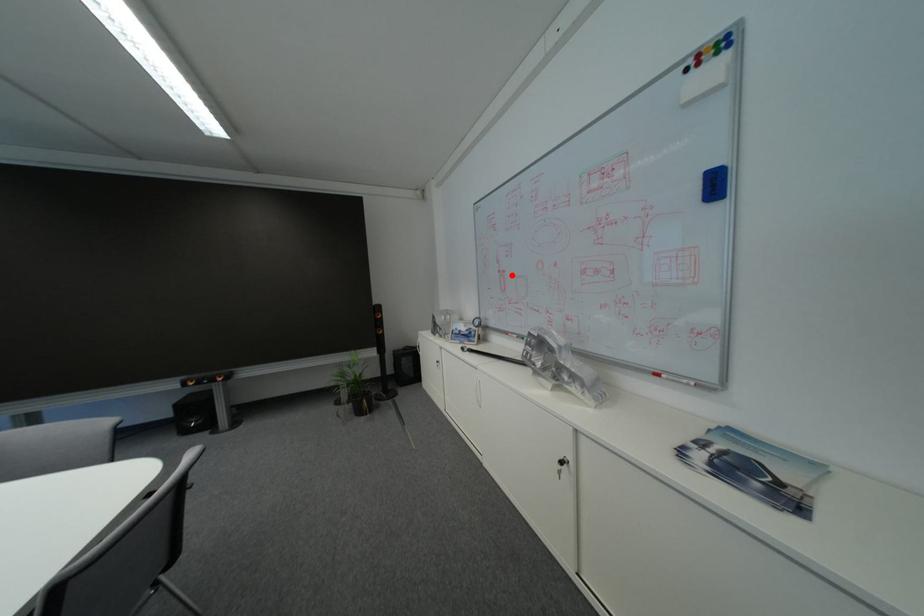
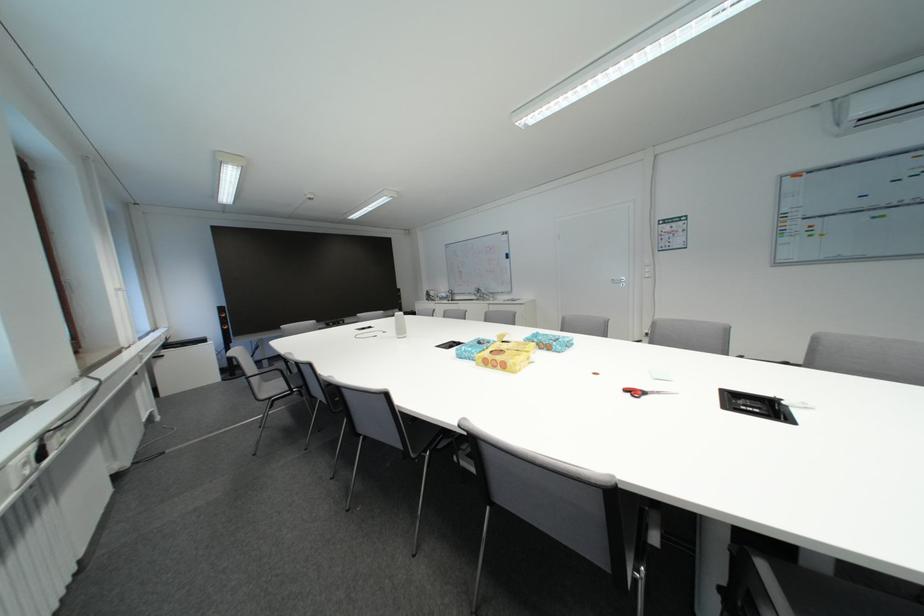
Question: I am providing you with two images of the same scene from different viewpoints. Given a red point in image1, look at the same physical point in image2. Is it:

Choices:
 (A) Closer to the viewpoint
 (B) Farther from the viewpoint

Answer: (A)